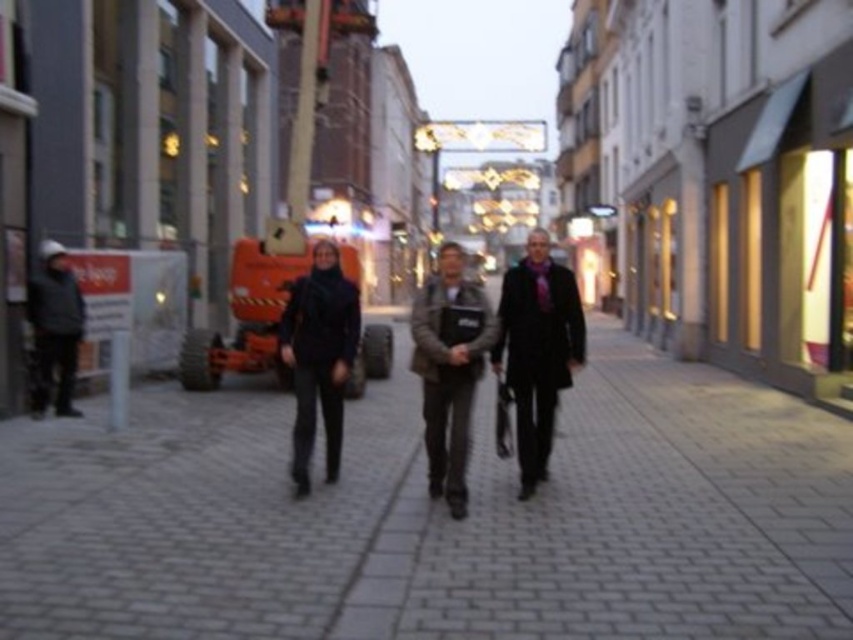
Question: Which of the following is the farthest from the observer?

Choices:
 (A) black wool coat at center
 (B) brown leather jacket at center
 (C) black matte suit at center

Answer: (C)

Question: Based on their relative distances, which object is farther from the gray brick pavement at center?

Choices:
 (A) black wool coat at center
 (B) black matte suit at center

Answer: (A)

Question: Is the position of gray brick pavement at center more distant than that of black wool coat at center?

Choices:
 (A) no
 (B) yes

Answer: (A)

Question: Is dark brown leather jacket at center smaller than black matte suit at center?

Choices:
 (A) yes
 (B) no

Answer: (B)

Question: Estimate the real-world distances between objects in this image. Which object is closer to the brown leather jacket at center?

Choices:
 (A) gray brick pavement at center
 (B) dark brown leather jacket at center

Answer: (B)

Question: Is black wool coat at center to the right of black matte suit at center from the viewer's perspective?

Choices:
 (A) no
 (B) yes

Answer: (B)